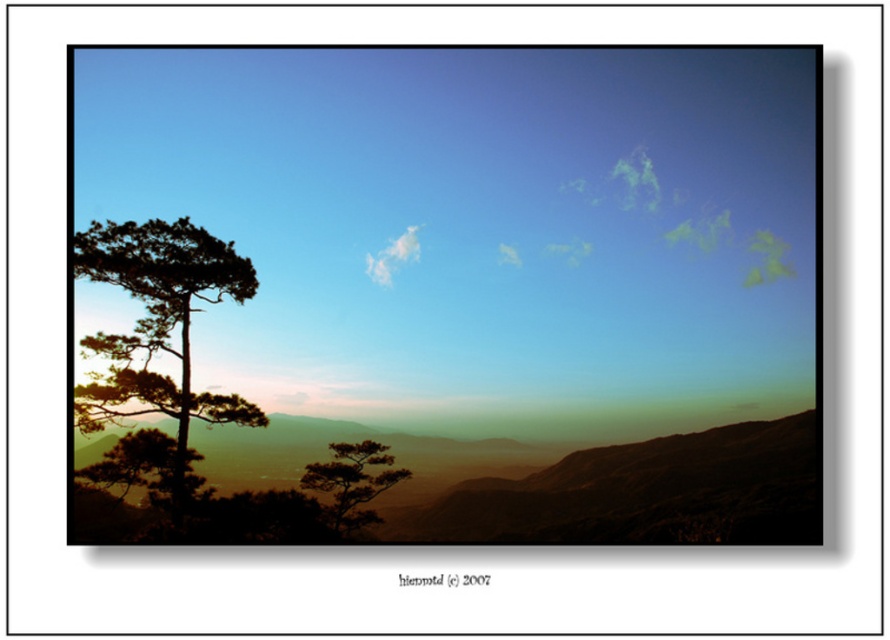
You are an artist trying to paint this landscape. You want to ensure that the silhouette wood tree at left and the white fluffy cloud at upper center are proportionally accurate. Based on the scene, which object should you draw wider?

The silhouette wood tree at left should be drawn wider than the white fluffy cloud at upper center because the description states that the silhouette wood tree at left might be wider than the white fluffy cloud at upper center.